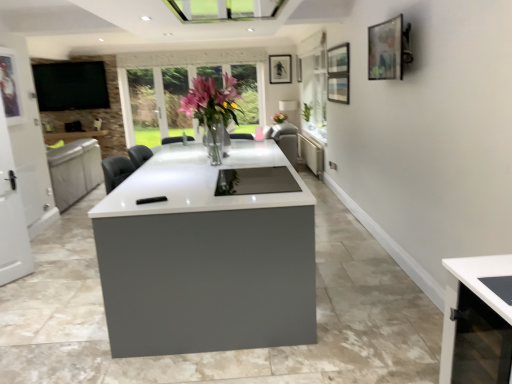
What do you see at coordinates (312, 155) in the screenshot?
I see `matte gray radiator at center` at bounding box center [312, 155].

What do you see at coordinates (386, 50) in the screenshot? This screenshot has height=384, width=512. I see `matte black picture frame at upper right, which is the 4th picture frame in left-to-right order` at bounding box center [386, 50].

What do you see at coordinates (298, 69) in the screenshot? I see `matte black picture frame at upper center, acting as the 2th picture frame starting from the right` at bounding box center [298, 69].

Where is `translucent glass vase at center`? The height and width of the screenshot is (384, 512). translucent glass vase at center is located at coordinates (213, 112).

The width and height of the screenshot is (512, 384). Describe the element at coordinates (71, 86) in the screenshot. I see `matte black tv at upper left` at that location.

The height and width of the screenshot is (384, 512). Describe the element at coordinates (11, 215) in the screenshot. I see `white glossy door at left` at that location.

Find the location of `matte gray radiator at center`. matte gray radiator at center is located at coordinates (312, 155).

Is matte black picture frame at upper center, which is counted as the 1th picture frame, starting from the top, next to metallic silver picture frame at left, which is the 3th picture frame from back to front?

matte black picture frame at upper center, which is counted as the 1th picture frame, starting from the top, and metallic silver picture frame at left, which is the 3th picture frame from back to front, are clearly separated.

In the scene shown: Considering the positions of objects matte black picture frame at upper center, which is counted as the third picture frame, starting from the right, and metallic silver picture frame at left, marked as the 1th picture frame in a left-to-right arrangement, in the image provided, who is more to the left, matte black picture frame at upper center, which is counted as the third picture frame, starting from the right, or metallic silver picture frame at left, marked as the 1th picture frame in a left-to-right arrangement,?

From the viewer's perspective, metallic silver picture frame at left, marked as the 1th picture frame in a left-to-right arrangement, appears more on the left side.

Considering the relative sizes of matte black picture frame at upper center, which is counted as the 1th picture frame, starting from the top, and metallic silver picture frame at left, the 4th picture frame viewed from the right, in the image provided, is matte black picture frame at upper center, which is counted as the 1th picture frame, starting from the top, shorter than metallic silver picture frame at left, the 4th picture frame viewed from the right,?

Yes, matte black picture frame at upper center, which is counted as the 1th picture frame, starting from the top, is shorter than metallic silver picture frame at left, the 4th picture frame viewed from the right.

Which is correct: matte black picture frame at upper center, which is counted as the 1th picture frame, starting from the top, is inside metallic silver picture frame at left, which appears as the 1th picture frame when ordered from the bottom, or outside of it?

matte black picture frame at upper center, which is counted as the 1th picture frame, starting from the top, cannot be found inside metallic silver picture frame at left, which appears as the 1th picture frame when ordered from the bottom.

Does metallic silver picture frame at left, acting as the 2th picture frame starting from the front, have a greater height compared to matte black picture frame at upper center, which appears as the third picture frame when viewed from the left?

Yes, metallic silver picture frame at left, acting as the 2th picture frame starting from the front, is taller than matte black picture frame at upper center, which appears as the third picture frame when viewed from the left.

Consider the image. Can you tell me how much metallic silver picture frame at left, arranged as the fourth picture frame when viewed from the top, and matte black picture frame at upper center, arranged as the 2th picture frame when viewed from the top, differ in facing direction?

180 degrees.

From the image's perspective, is metallic silver picture frame at left, which appears as the 1th picture frame when ordered from the bottom, above matte black picture frame at upper center, positioned as the third picture frame in bottom-to-top order?

No, from the image's perspective, metallic silver picture frame at left, which appears as the 1th picture frame when ordered from the bottom, is not over matte black picture frame at upper center, positioned as the third picture frame in bottom-to-top order.

Considering the positions of objects white glossy door at left and green leafy plant at center in the image provided, who is behind, white glossy door at left or green leafy plant at center?

green leafy plant at center is further away from the camera.

From the image's perspective, is white glossy door at left beneath green leafy plant at center?

Yes.

Is white glossy door at left next to green leafy plant at center and touching it?

They are not placed beside each other.

Find the location of `plant on the right side of white glossy door at left`. plant on the right side of white glossy door at left is located at coordinates (307, 111).

Can you tell me how much matte gray radiator at center and metallic silver picture frame at left, which is the 3th picture frame from back to front, differ in facing direction?

The angle between the facing direction of matte gray radiator at center and the facing direction of metallic silver picture frame at left, which is the 3th picture frame from back to front, is 179 degrees.

Is matte gray radiator at center closer to the viewer compared to metallic silver picture frame at left, acting as the 2th picture frame starting from the front?

No, matte gray radiator at center is further to the viewer.

From a real-world perspective, is matte gray radiator at center over metallic silver picture frame at left, arranged as the fourth picture frame when viewed from the top?

No, from a real-world perspective, matte gray radiator at center is not above metallic silver picture frame at left, arranged as the fourth picture frame when viewed from the top.

Would you say matte black picture frame at upper right, marked as the second picture frame in a bottom-to-top arrangement, is to the left or to the right of metallic silver picture frame at left, arranged as the fourth picture frame when viewed from the top, in the picture?

Based on their positions, matte black picture frame at upper right, marked as the second picture frame in a bottom-to-top arrangement, is located to the right of metallic silver picture frame at left, arranged as the fourth picture frame when viewed from the top.

How different are the orientations of matte black picture frame at upper right, the 1th picture frame positioned from the front, and metallic silver picture frame at left, which is the 3th picture frame from back to front, in degrees?

The angle between the facing direction of matte black picture frame at upper right, the 1th picture frame positioned from the front, and the facing direction of metallic silver picture frame at left, which is the 3th picture frame from back to front, is 179 degrees.

Does point (390, 31) come closer to viewer compared to point (16, 83)?

Yes, it is in front of point (16, 83).

Can we say translucent glass vase at center lies outside matte gray radiator at center?

That's correct, translucent glass vase at center is outside of matte gray radiator at center.

From their relative heights in the image, would you say translucent glass vase at center is taller or shorter than matte gray radiator at center?

In the image, translucent glass vase at center appears to be taller than matte gray radiator at center.

Which of these two, translucent glass vase at center or matte gray radiator at center, is thinner?

matte gray radiator at center.

Is translucent glass vase at center further to the viewer compared to matte gray radiator at center?

No, it is in front of matte gray radiator at center.

From a real-world perspective, is matte gray radiator at center under matte black picture frame at upper center, which appears as the third picture frame when viewed from the left?

Indeed, from a real-world perspective, matte gray radiator at center is positioned beneath matte black picture frame at upper center, which appears as the third picture frame when viewed from the left.

How far apart are matte gray radiator at center and matte black picture frame at upper center, the third picture frame viewed from the front?

1.61 meters.

Is point (322, 153) closer to viewer compared to point (301, 61)?

Yes, it is in front of point (301, 61).

Image resolution: width=512 pixels, height=384 pixels. Identify the location of picture frame lying on the left of matte black picture frame at upper center, which is counted as the third picture frame, starting from the right. (9, 87).

From a real-world perspective, starting from the matte black picture frame at upper center, the third picture frame viewed from the front, which picture frame is the 3rd one below it? Please provide its 2D coordinates.

[(9, 87)]

Looking at the image, which one is located closer to white glossy door at left, metallic silver picture frame at left, arranged as the fourth picture frame when viewed from the top, or matte black picture frame at upper right, which is the fourth picture frame from back to front?

metallic silver picture frame at left, arranged as the fourth picture frame when viewed from the top, lies closer to white glossy door at left than the other object.

Based on their spatial positions, is translucent glass vase at center or matte black picture frame at upper center, positioned as the 1th picture frame in back-to-front order, closer to matte black picture frame at upper center, positioned as the 2th picture frame in back-to-front order?

The object closer to matte black picture frame at upper center, positioned as the 2th picture frame in back-to-front order, is matte black picture frame at upper center, positioned as the 1th picture frame in back-to-front order.

Which object lies further to the anchor point translucent glass vase at center, matte gray radiator at center or metallic silver picture frame at left, acting as the 2th picture frame starting from the front?

matte gray radiator at center lies further to translucent glass vase at center than the other object.

Considering their positions, is white glossy door at left positioned closer to matte black picture frame at upper center, which ranks as the fourth picture frame in front-to-back order, than green leafy plant at center?

The object closer to matte black picture frame at upper center, which ranks as the fourth picture frame in front-to-back order, is green leafy plant at center.

Based on the photo, looking at the image, which one is located further to green leafy plant at center, matte black tv at upper left or metallic silver picture frame at left, acting as the 2th picture frame starting from the front?

metallic silver picture frame at left, acting as the 2th picture frame starting from the front, is further to green leafy plant at center.

From the image, which object appears to be farther from white glossy door at left, matte black picture frame at upper right, which is the fourth picture frame from back to front, or matte black picture frame at upper center, the 2th picture frame viewed from the left?

matte black picture frame at upper center, the 2th picture frame viewed from the left, lies further to white glossy door at left than the other object.

Looking at the image, which one is located closer to matte black picture frame at upper center, the 2th picture frame viewed from the left, green leafy plant at center or translucent glass vase at center?

green leafy plant at center is closer to matte black picture frame at upper center, the 2th picture frame viewed from the left.

Considering their positions, is white glossy door at left positioned further to matte black tv at upper left than matte black picture frame at upper right, which is the 4th picture frame in left-to-right order?

matte black picture frame at upper right, which is the 4th picture frame in left-to-right order.

Where is `floral arrangement between matte black picture frame at upper right, which is the fourth picture frame from back to front, and matte gray radiator at center in the front-back direction`? floral arrangement between matte black picture frame at upper right, which is the fourth picture frame from back to front, and matte gray radiator at center in the front-back direction is located at coordinates coord(213,112).

Locate an element on the screen. Image resolution: width=512 pixels, height=384 pixels. plant between metallic silver picture frame at left, marked as the 1th picture frame in a left-to-right arrangement, and matte black tv at upper left in the front-back direction is located at coordinates (307, 111).

The width and height of the screenshot is (512, 384). In order to click on cabinetry located between white glossy door at left and green leafy plant at center in the depth direction in this screenshot , I will do `click(312, 155)`.

Locate an element on the screen. This screenshot has width=512, height=384. cabinetry between white glossy door at left and matte black picture frame at upper center, positioned as the 1th picture frame in back-to-front order, along the z-axis is located at coordinates (312, 155).